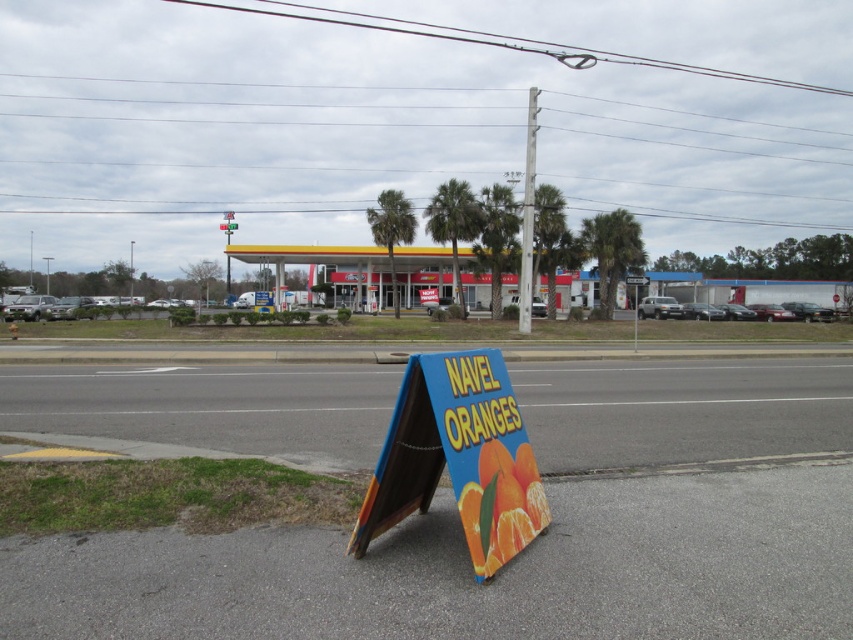
You are standing at the roadside scene with a gas station and a fruit stand sign. You want to know the distance to the point marked at coordinates point (x=526, y=205). Can you determine how far it is from your current position?

The point (x=526, y=205) is 37.13 meters from viewer, so the distance is 37.13 meters.

You are driving a delivery truck that is 2.5 meters wide. You need to pass through the space between the white glossy gas station at center and the metallic silver street sign at center. Can your truck fit through without touching either object?

The white glossy gas station at center might be wider than the metallic silver street sign at center, so there is uncertainty about the available space. To ensure safety, it is recommended to measure the distance or choose an alternative route to avoid potential collision.

You are standing at the gas station and want to walk towards the fruit stand sign. Which point, point [469,250] or point [225,275], should you head towards?

You should head towards point [469,250] because it is in front of point [225,275], meaning it is closer to your current position at the gas station.